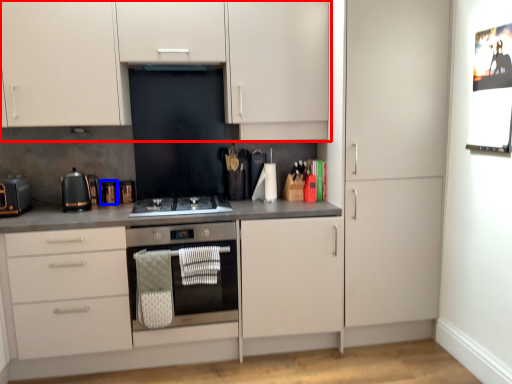
Question: Which object appears closest to the camera in this image, cabinetry (highlighted by a red box) or appliance (highlighted by a blue box)?

Choices:
 (A) cabinetry
 (B) appliance

Answer: (A)